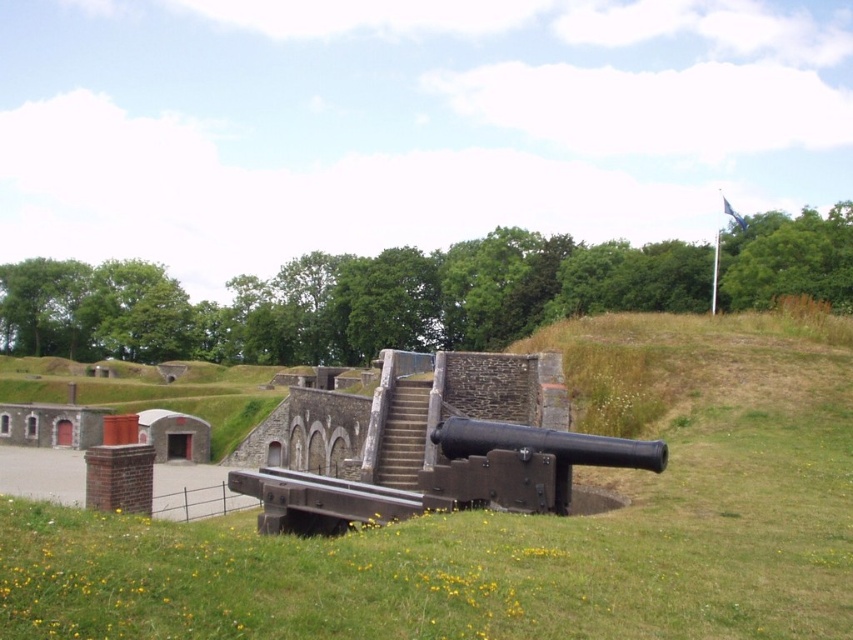
Describe the element at coordinates (515, 529) in the screenshot. I see `green grassy at center` at that location.

Measure the distance between green grassy at center and black matte cannon at center.

They are 6.34 meters apart.

The image size is (853, 640). In order to click on green grassy at center in this screenshot , I will do `click(515, 529)`.